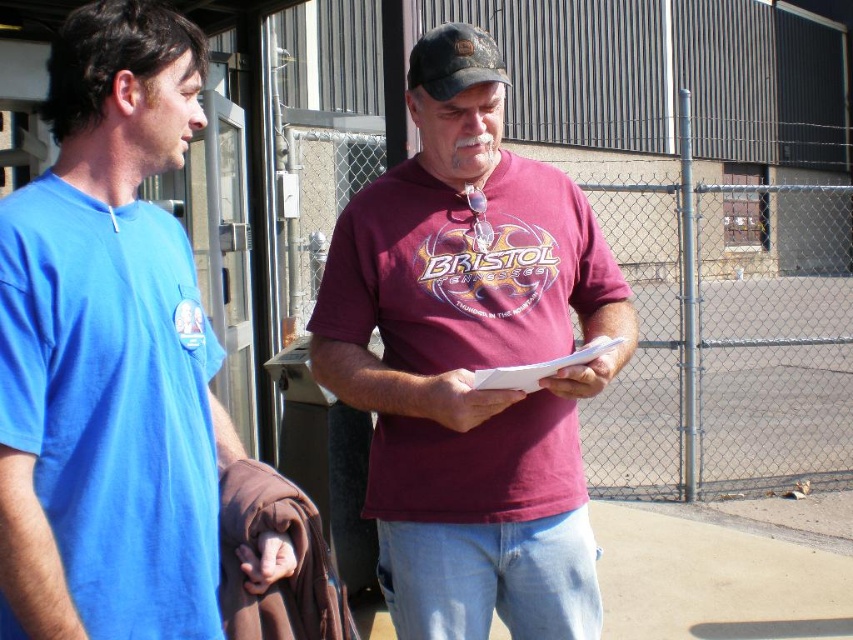
Question: Which of the following is the farthest from the observer?

Choices:
 (A) maroon t-shirt at center
 (B) black fabric baseball cap at center
 (C) metallic chain-link fence at center-right

Answer: (C)

Question: Which object appears farthest from the camera in this image?

Choices:
 (A) blue cotton shirt at left
 (B) metallic chain-link fence at center-right
 (C) black fabric baseball cap at center

Answer: (B)

Question: Is metallic chain-link fence at center-right below black fabric baseball cap at center?

Choices:
 (A) no
 (B) yes

Answer: (A)

Question: Which point is farther from the camera taking this photo?

Choices:
 (A) (746, 477)
 (B) (544, 497)

Answer: (A)

Question: Does blue cotton shirt at left lie in front of metallic chain-link fence at center-right?

Choices:
 (A) yes
 (B) no

Answer: (A)

Question: Does maroon t-shirt at center have a smaller size compared to black fabric baseball cap at center?

Choices:
 (A) yes
 (B) no

Answer: (B)